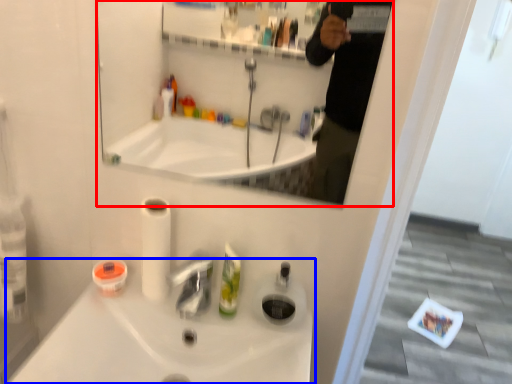
Question: Which object is closer to the camera taking this photo, mirror (highlighted by a red box) or sink (highlighted by a blue box)?

Choices:
 (A) mirror
 (B) sink

Answer: (A)